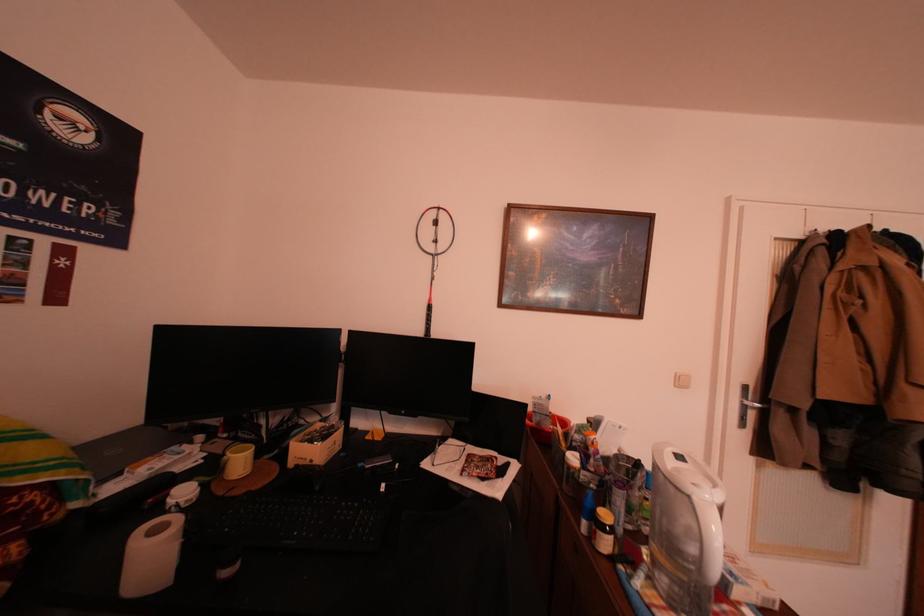
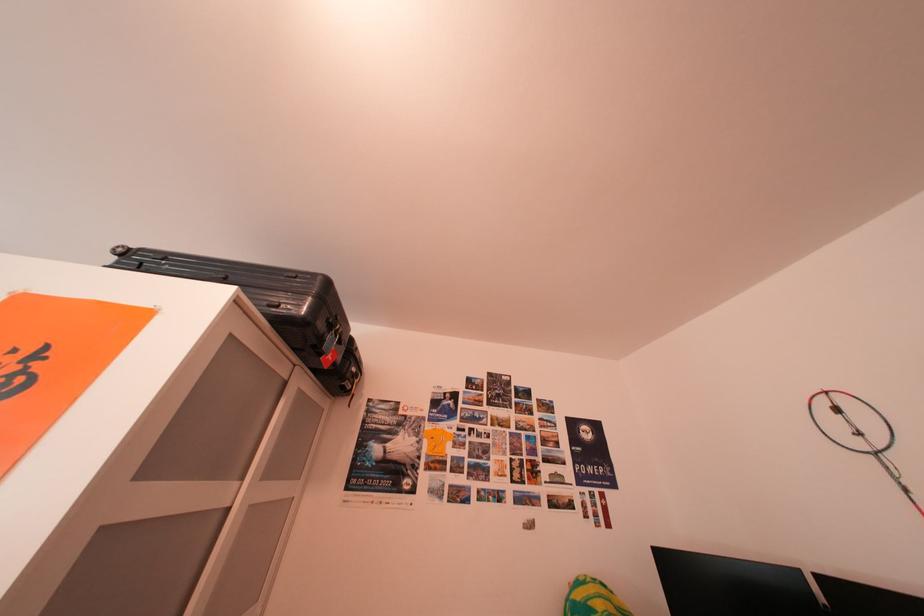
First-person continuous shooting, in which direction is the camera rotating?

The camera's rotation is toward left-up.